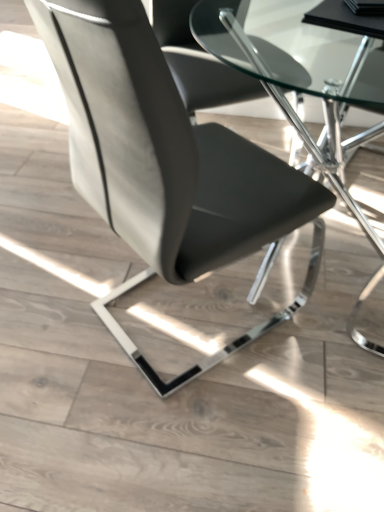
In order to click on vacant space situated on the left part of transparent glass table at center in this screenshot , I will do `click(51, 261)`.